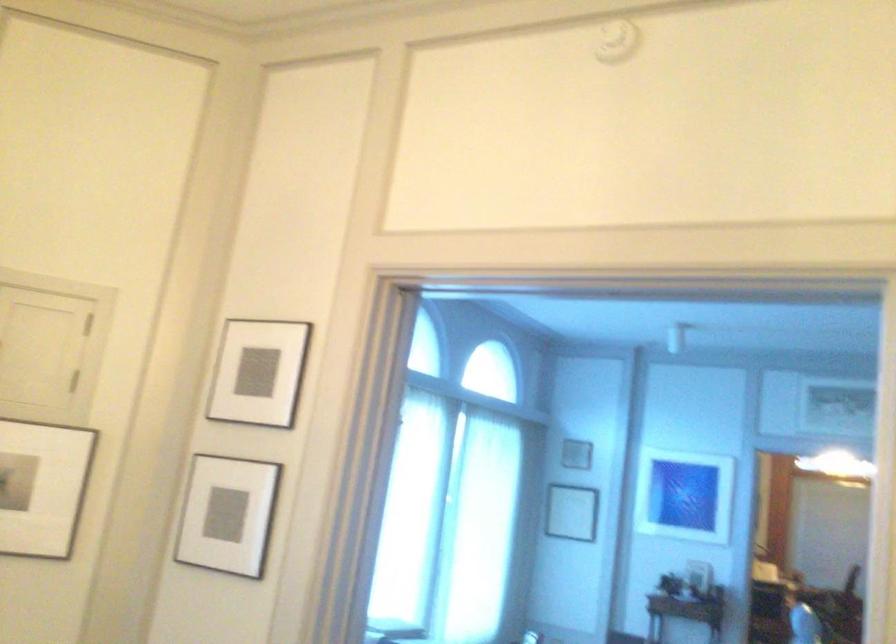
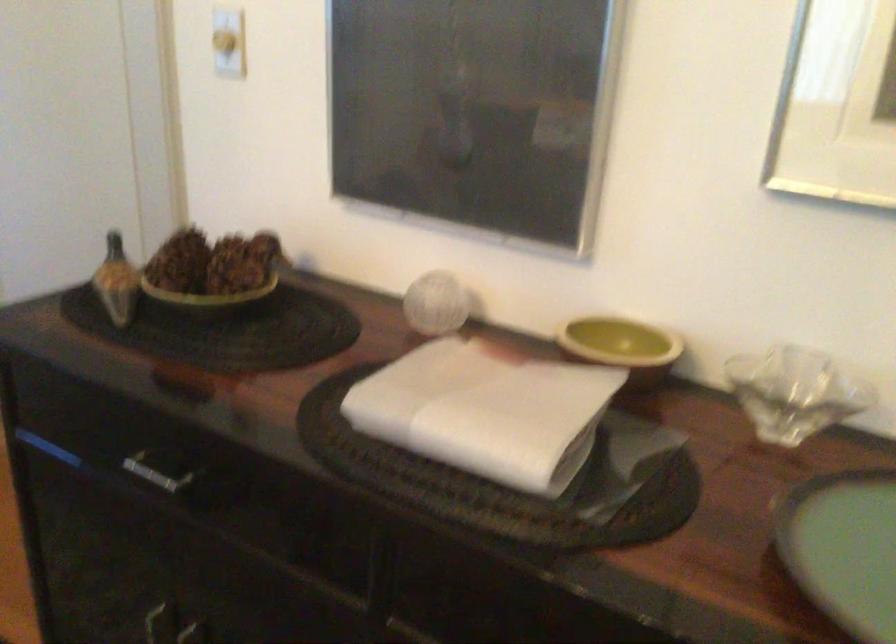
Based on the continuous images, in which direction is the camera rotating?

The camera rotated toward right-down.